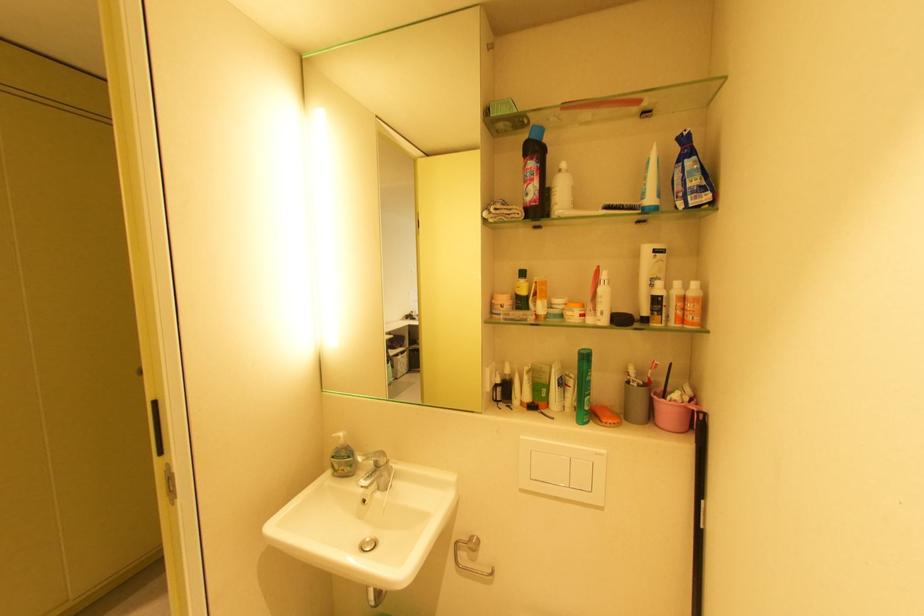
Image resolution: width=924 pixels, height=616 pixels. Find the location of `metal faucet handle`. metal faucet handle is located at coordinates (373, 458).